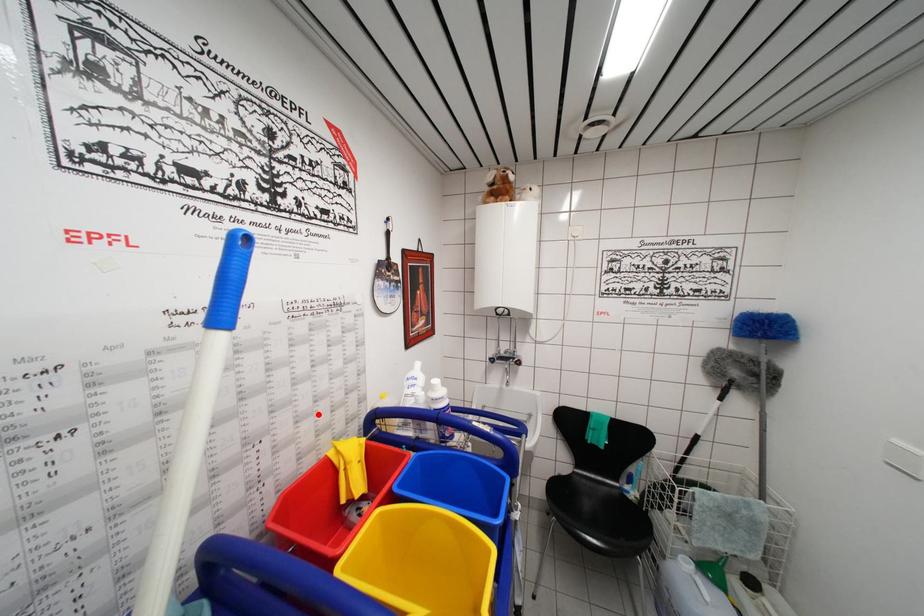
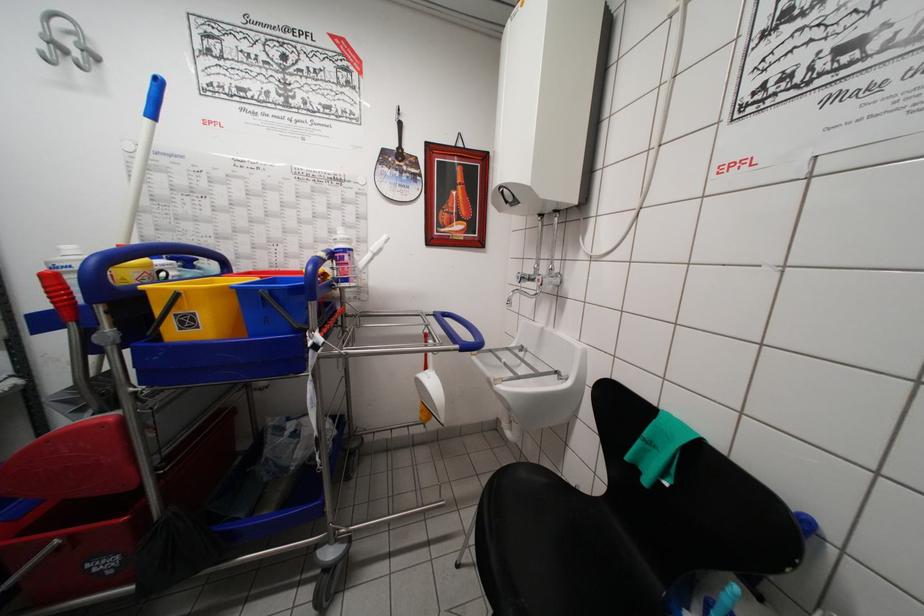
Locate, in the second image, the point that corresponds to the highlighted location in the first image.

(319, 252)